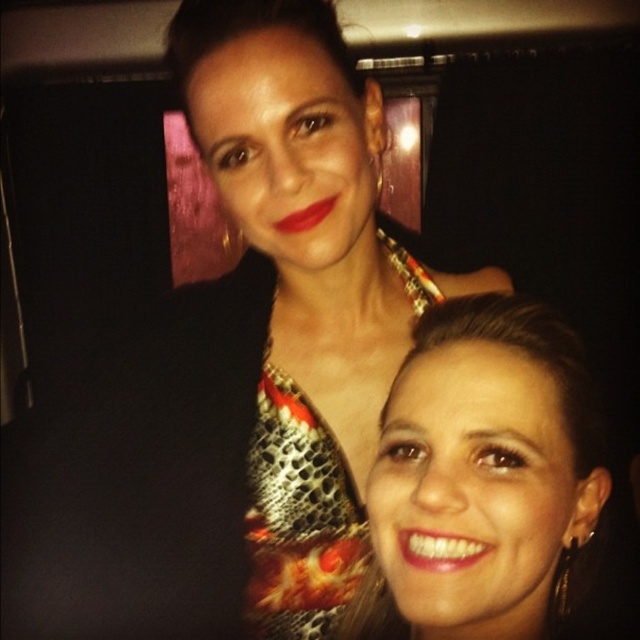
You are a photographer trying to adjust the lighting for a photo shoot. You notice the matte gold earrings at lower right and the metallic snakeskin dress at center. Which object should you focus on first to ensure proper reflection control, considering their positions?

The matte gold earrings at lower right should be focused on first because they are in front of the metallic snakeskin dress at center, making their reflections more prominent in the frame.

You are a photographer adjusting the camera focus. The camera has a focus point at coordinates 0.748, 0.755. Which object in the scene should you focus on to capture the matte gold earrings at lower right clearly?

The matte gold earrings at lower right are positioned at point (x=483, y=477), so focusing the camera at those coordinates will ensure they are in clear focus.